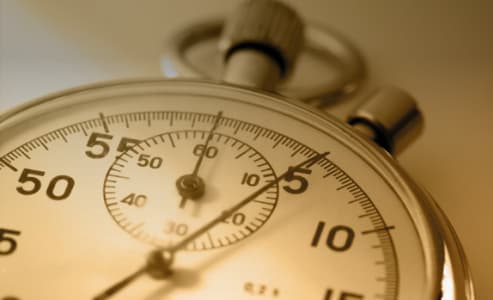
Identify the location of large clock. (151, 267).